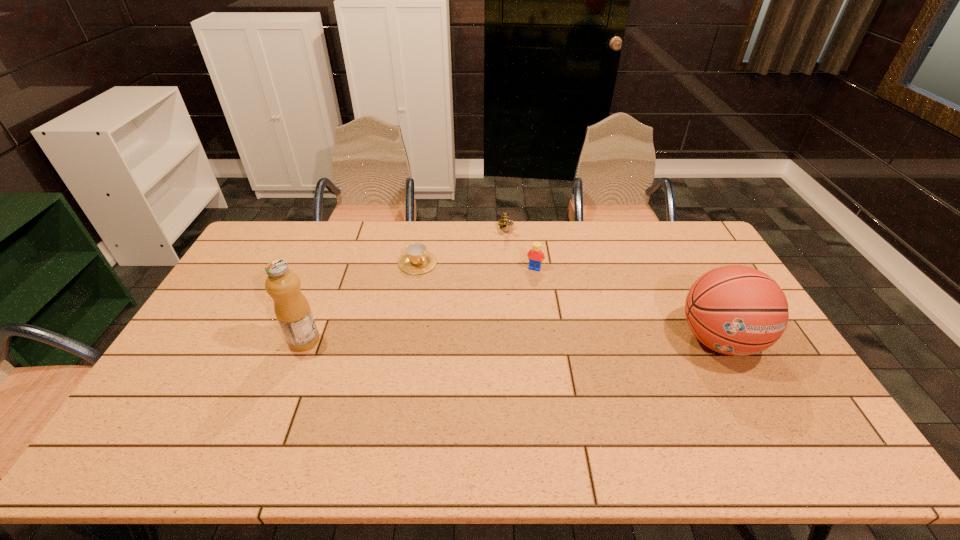
Identify the location of cup located in the far edge section of the desktop. (417, 260).

Where is `snail that is at the far edge`? snail that is at the far edge is located at coordinates (505, 221).

Locate an element on the screen. Image resolution: width=960 pixels, height=540 pixels. object present at the right edge is located at coordinates (736, 310).

At what (x,y) coordinates should I click in order to perform the action: click on vacant space at the far edge. Please return your answer as a coordinate pair (x, y). This screenshot has width=960, height=540. Looking at the image, I should click on (525, 241).

Locate an element on the screen. This screenshot has width=960, height=540. vacant space at the near edge of the desktop is located at coordinates (516, 410).

Identify the location of vacant space at the left edge. The image size is (960, 540). (215, 367).

You are a GUI agent. You are given a task and a screenshot of the screen. Output one action in this format:
    pyautogui.click(x=<x>, y=<y>)
    Task: Click on the free space at the right edge of the desktop
    The image size is (960, 540).
    Given the screenshot: What is the action you would take?
    pyautogui.click(x=704, y=261)

At what (x,y) coordinates should I click in order to perform the action: click on free space at the far left corner. Please return your answer as a coordinate pair (x, y). Looking at the image, I should click on (279, 235).

The width and height of the screenshot is (960, 540). Find the location of `free space at the near left corner of the desktop`. free space at the near left corner of the desktop is located at coordinates (142, 422).

Image resolution: width=960 pixels, height=540 pixels. In order to click on vacant area between the rightmost object and the third object from left to right in this screenshot , I will do `click(612, 286)`.